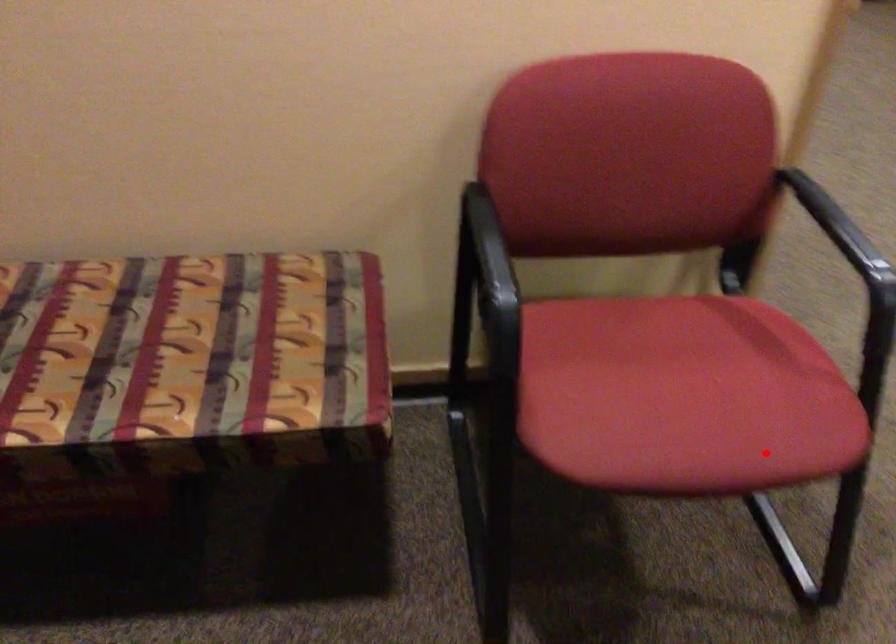
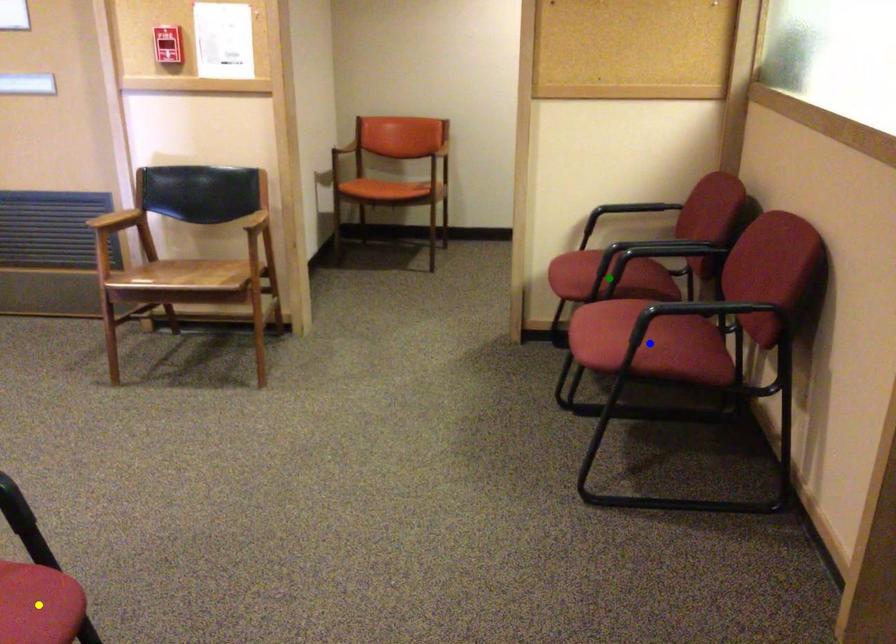
Question: I am providing you with two images of the same scene from different viewpoints. A red point is marked on the first image. You are given multiple points on the second image. In image 2, which mark is for the same physical point as the one in image 1?

Choices:
 (A) green point
 (B) yellow point
 (C) blue point

Answer: (B)